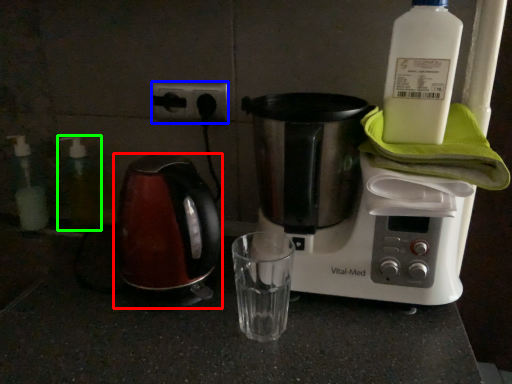
Question: Considering the real-world distances, which object is closest to kettle (highlighted by a red box)? electric outlet (highlighted by a blue box) or bottle (highlighted by a green box).

Choices:
 (A) electric outlet
 (B) bottle

Answer: (A)